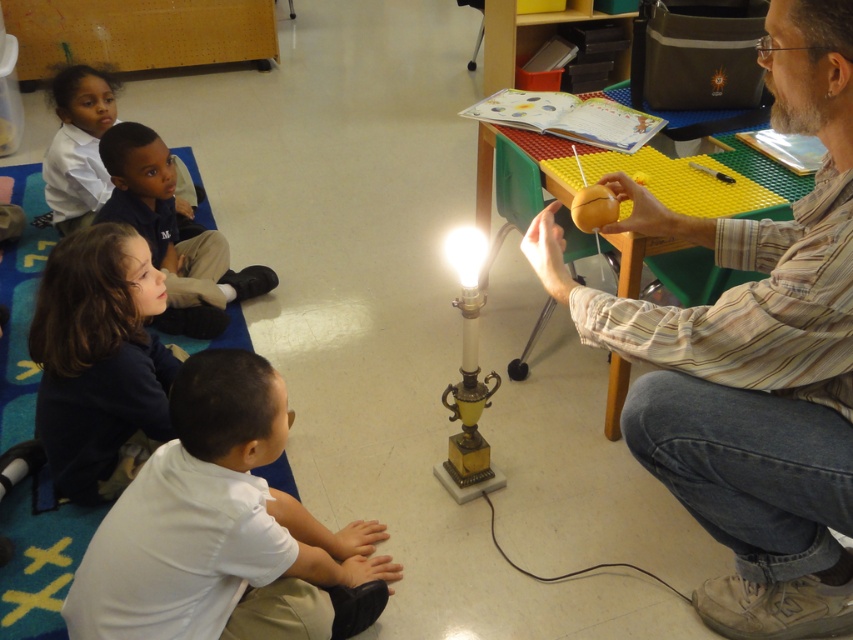
You are a student sitting on the floor in the classroom. You want to reach the matte brown ball at right without moving past the matte white shirt at upper left. Is this possible?

The matte brown ball at right is in front of the matte white shirt at upper left, so you can reach it without moving past the matte white shirt at upper left.

You are a student sitting in the classroom and want to ask the teacher a question. Which of the two people, the dark blue shirt at lower left or the matte white shirt at upper left, is more likely to be the teacher based on their height?

The dark blue shirt at lower left is much taller than the matte white shirt at upper left, so the dark blue shirt at lower left is more likely to be the teacher.

Based on the coordinates provided, where is the matte brown ball at right located in the classroom scene?

The matte brown ball at right is located at point 0.559 on the x axis and 0.883 on the y axis.